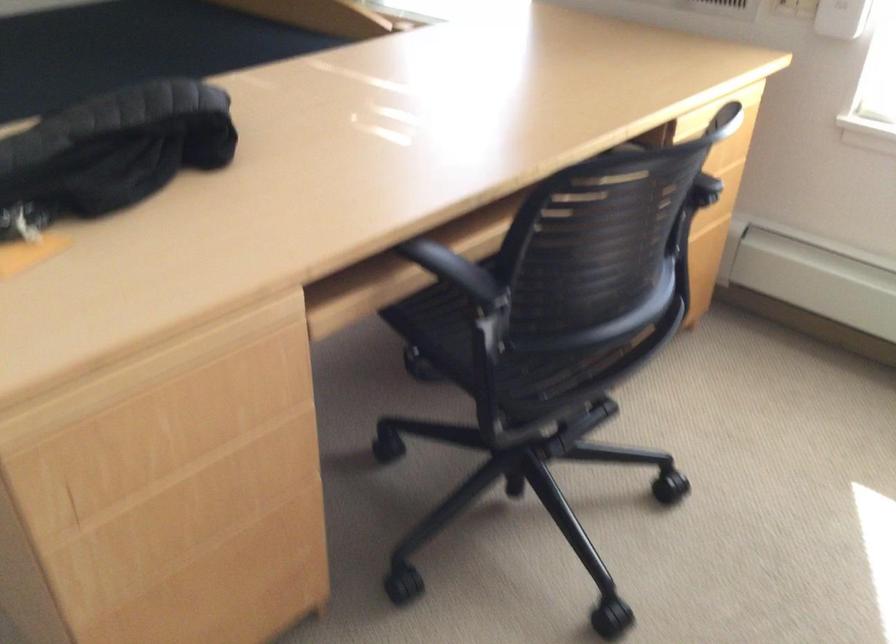
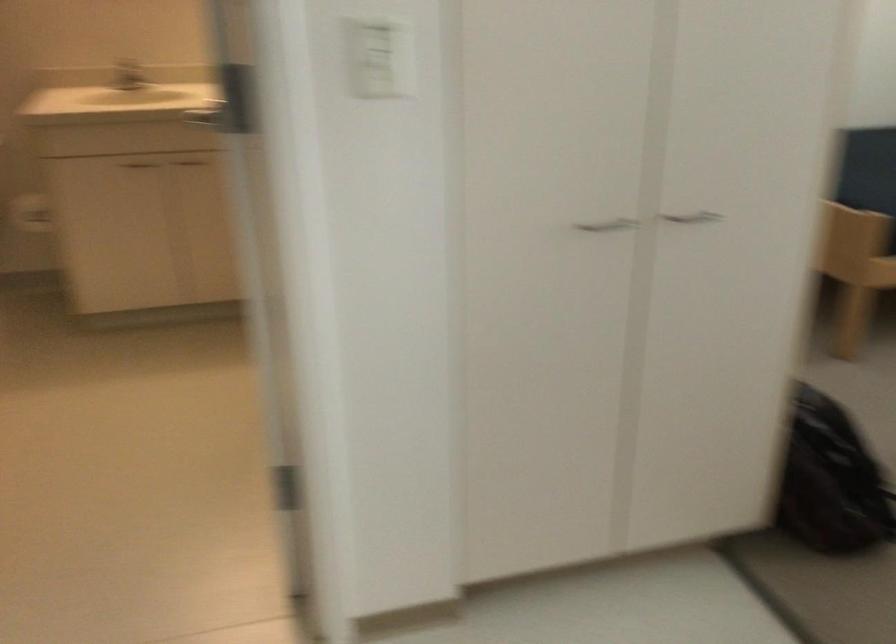
In the scene shown: In a continuous first-person perspective shot, in which direction is the camera moving?

The movement direction of the cameraman is left, backward.